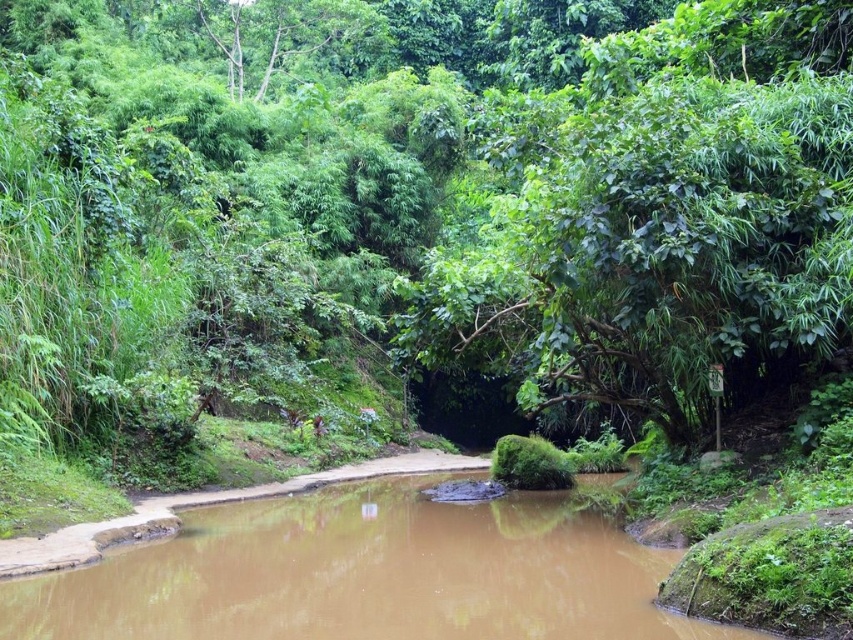
Question: Which point appears closest to the camera in this image?

Choices:
 (A) (399, 536)
 (B) (653, 124)

Answer: (B)

Question: In this image, where is green leafy tree at center located relative to brown muddy water at center?

Choices:
 (A) right
 (B) left

Answer: (A)

Question: Is green leafy tree at center bigger than brown muddy water at center?

Choices:
 (A) yes
 (B) no

Answer: (A)

Question: Considering the relative positions of green leafy tree at center and brown muddy water at center in the image provided, where is green leafy tree at center located with respect to brown muddy water at center?

Choices:
 (A) right
 (B) left

Answer: (A)

Question: Which object appears closest to the camera in this image?

Choices:
 (A) brown muddy water at center
 (B) green leafy tree at center

Answer: (A)

Question: Which point appears closest to the camera in this image?

Choices:
 (A) (282, 593)
 (B) (811, 268)

Answer: (A)